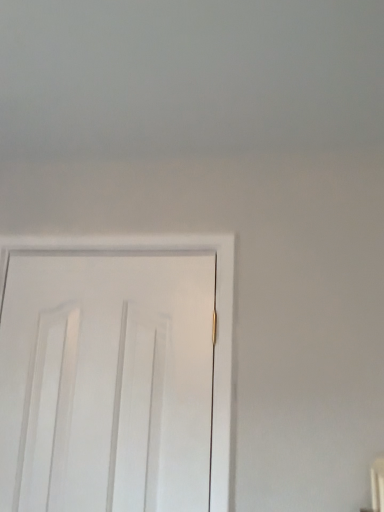
At what (x,y) coordinates should I click in order to perform the action: click on white matte door at center. Please return your answer as a coordinate pair (x, y). Looking at the image, I should click on (106, 382).

What do you see at coordinates (106, 382) in the screenshot?
I see `white matte door at center` at bounding box center [106, 382].

Image resolution: width=384 pixels, height=512 pixels. Identify the location of white matte door at center. (106, 382).